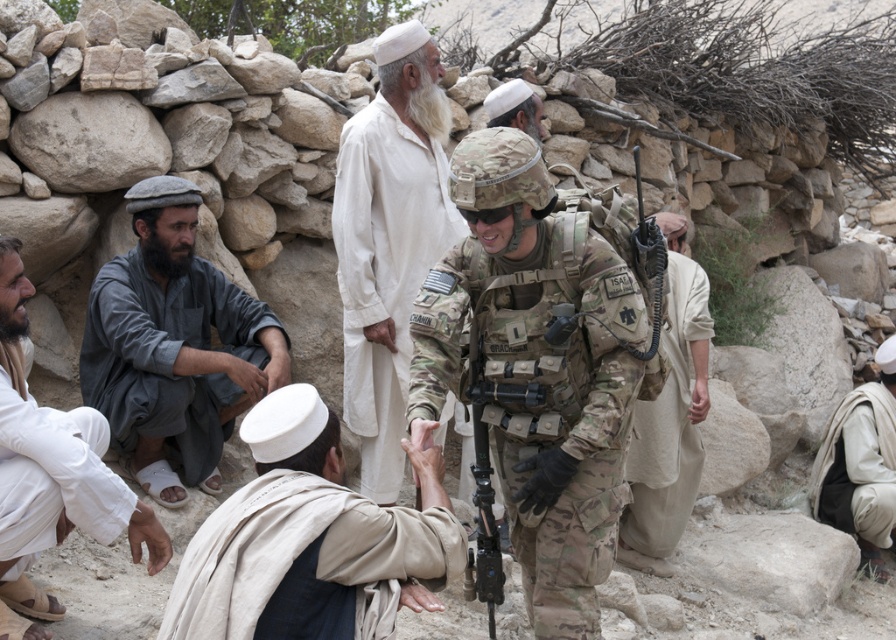
Question: Which object is closer to the camera taking this photo?

Choices:
 (A) white cotton pants at lower left
 (B) white cotton robe at center
 (C) gray cotton robe at left

Answer: (A)

Question: Does camouflage fabric uniform at center appear on the right side of camouflage uniform at center?

Choices:
 (A) no
 (B) yes

Answer: (A)

Question: Considering the real-world distances, which object is closest to the camouflage uniform at center?

Choices:
 (A) beige fabric at lower right
 (B) light beige fabric at lower center
 (C) white cotton robe at lower left

Answer: (A)

Question: Can you confirm if light beige fabric at lower center is positioned to the left of beige fabric at lower right?

Choices:
 (A) no
 (B) yes

Answer: (B)

Question: Which of the following is the farthest from the observer?

Choices:
 (A) [x=205, y=545]
 (B) [x=340, y=209]
 (C) [x=888, y=342]

Answer: (C)

Question: Can you confirm if white cotton robe at center is smaller than white cotton pants at lower left?

Choices:
 (A) no
 (B) yes

Answer: (A)